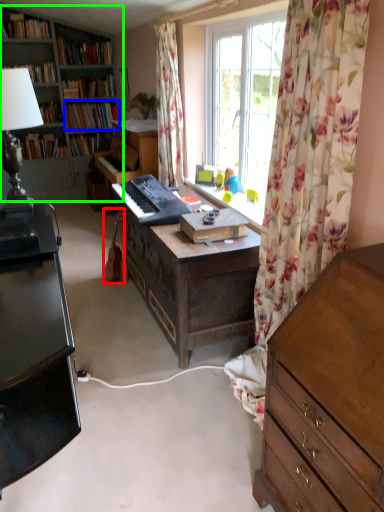
Question: Which is nearer to the instrument (highlighted by a red box)? book (highlighted by a blue box) or bookcase (highlighted by a green box).

Choices:
 (A) book
 (B) bookcase

Answer: (B)